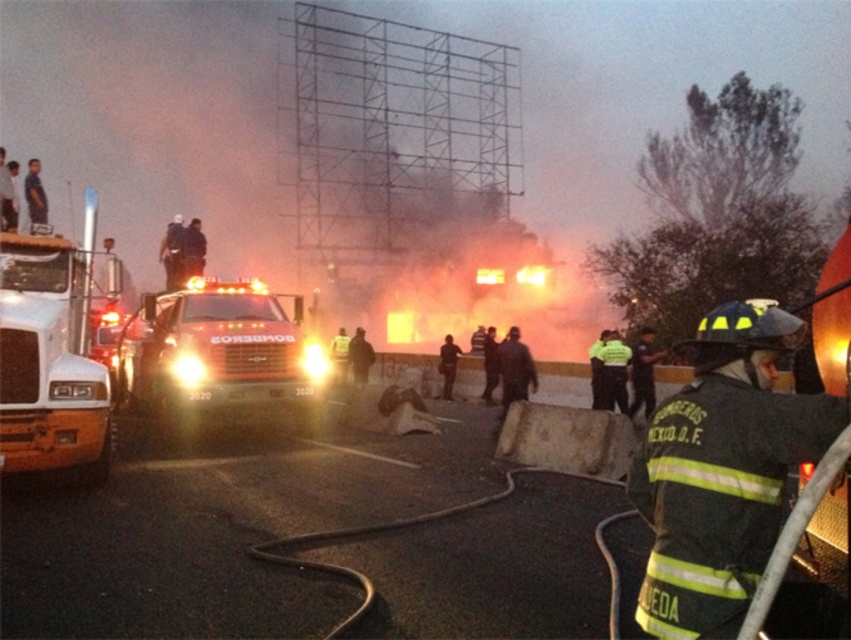
Question: Which of the following is the closest to the observer?

Choices:
 (A) shiny silver fire truck at center
 (B) white glossy fire truck at left
 (C) dark green reflective uniform at center

Answer: (C)

Question: Which object appears closest to the camera in this image?

Choices:
 (A) dark green reflective uniform at center
 (B) shiny silver fire truck at center
 (C) white glossy fire truck at left

Answer: (A)

Question: Does dark green reflective uniform at center appear under white glossy fire truck at left?

Choices:
 (A) yes
 (B) no

Answer: (A)

Question: Is dark green reflective uniform at center bigger than white glossy fire truck at left?

Choices:
 (A) yes
 (B) no

Answer: (B)

Question: Does dark green reflective uniform at center appear under white glossy fire truck at left?

Choices:
 (A) no
 (B) yes

Answer: (B)

Question: Among these objects, which one is farthest from the camera?

Choices:
 (A) white glossy fire truck at left
 (B) dark green reflective uniform at center

Answer: (A)